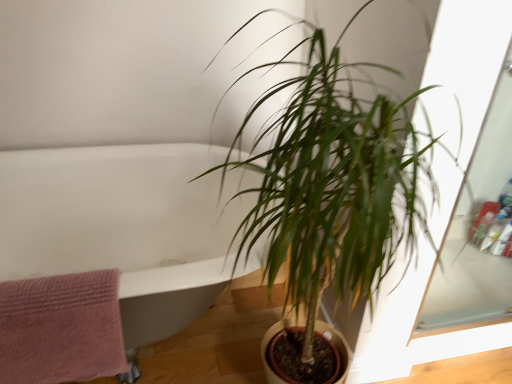
Question: Considering the relative positions of white glossy bathtub at upper left and pink textured towel at left in the image provided, is white glossy bathtub at upper left to the left of pink textured towel at left from the viewer's perspective?

Choices:
 (A) no
 (B) yes

Answer: (A)

Question: From a real-world perspective, is white glossy bathtub at upper left under pink textured towel at left?

Choices:
 (A) yes
 (B) no

Answer: (A)

Question: Is the surface of white glossy bathtub at upper left in direct contact with pink textured towel at left?

Choices:
 (A) yes
 (B) no

Answer: (B)

Question: Does white glossy bathtub at upper left lie in front of pink textured towel at left?

Choices:
 (A) no
 (B) yes

Answer: (B)

Question: From the image's perspective, is white glossy bathtub at upper left beneath pink textured towel at left?

Choices:
 (A) yes
 (B) no

Answer: (B)

Question: Can you confirm if white glossy bathtub at upper left is smaller than pink textured towel at left?

Choices:
 (A) yes
 (B) no

Answer: (B)

Question: Is green leafy plant at center turned away from white glossy bathtub at upper left?

Choices:
 (A) yes
 (B) no

Answer: (A)

Question: From the image's perspective, is green leafy plant at center above white glossy bathtub at upper left?

Choices:
 (A) yes
 (B) no

Answer: (A)

Question: Considering the relative positions of green leafy plant at center and white glossy bathtub at upper left in the image provided, is green leafy plant at center in front of white glossy bathtub at upper left?

Choices:
 (A) no
 (B) yes

Answer: (B)

Question: Would you say green leafy plant at center is a long distance from white glossy bathtub at upper left?

Choices:
 (A) no
 (B) yes

Answer: (A)

Question: Is green leafy plant at center surrounding white glossy bathtub at upper left?

Choices:
 (A) yes
 (B) no

Answer: (B)

Question: Does green leafy plant at center touch white glossy bathtub at upper left?

Choices:
 (A) no
 (B) yes

Answer: (A)

Question: Is white glossy bathtub at upper left not within green leafy plant at center?

Choices:
 (A) yes
 (B) no

Answer: (A)